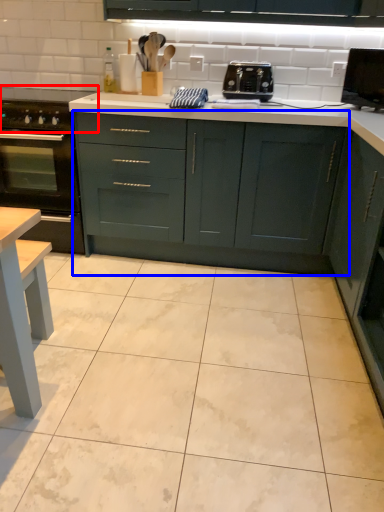
Question: Among these objects, which one is nearest to the camera, gas stove (highlighted by a red box) or cabinetry (highlighted by a blue box)?

Choices:
 (A) gas stove
 (B) cabinetry

Answer: (B)